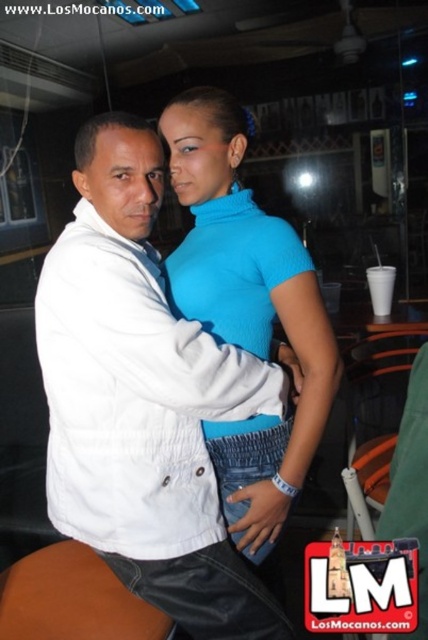
You are a photographer standing at the entrance of the room. You want to take a photo of the two people in the foreground without them noticing. The camera you are using has a focal length of 50mm. According to the rule of thirds, where should you position the white matte jacket at center in the frame?

The white matte jacket at center should be positioned at the intersection of the grid lines created by the rule of thirds to create a balanced and aesthetically pleasing composition.

You are taking a photo of the scene and want to focus on both the point at coordinates point [172,140] and point [62,580]. Which point should you adjust your focus to first to ensure both are in sharp detail?

Point [172,140] is closer to the camera than point [62,580], so you should focus on point [172,140] first to ensure both points are in sharp detail.

From the picture: You are a photographer setting up a shoot in this scene. You need to place a small tripod between the white matte jacket at center and the brown leather stool at lower left. Considering their sizes, which object should the tripod be closer to to ensure stability?

The white matte jacket at center is larger in size than the brown leather stool at lower left. To ensure stability, the tripod should be placed closer to the white matte jacket at center because its larger size provides a more stable reference point for positioning.